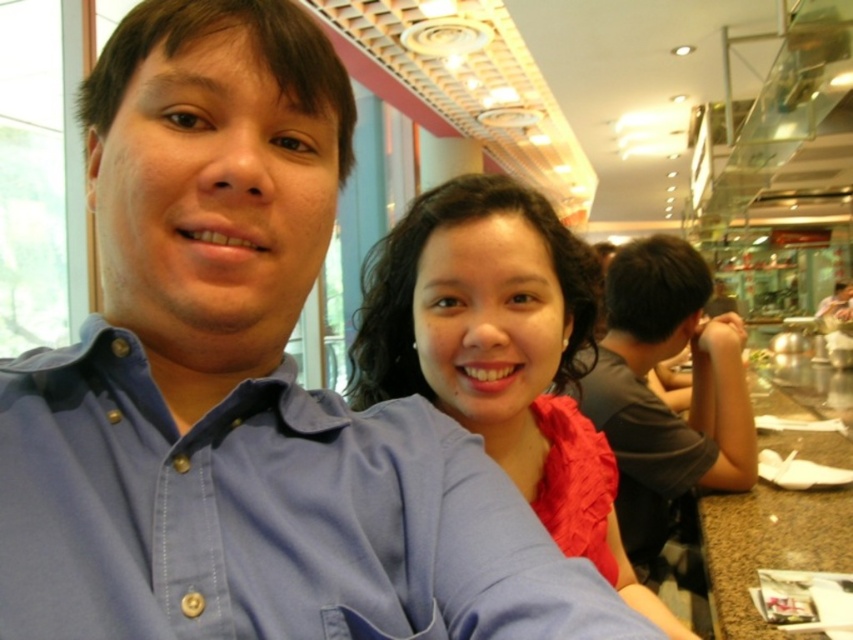
Is matte blue shirt at center to the left of dark gray t-shirt at right from the viewer's perspective?

Correct, you'll find matte blue shirt at center to the left of dark gray t-shirt at right.

I want to click on matte blue shirt at center, so click(x=502, y=353).

This screenshot has height=640, width=853. What are the coordinates of `matte blue shirt at center` in the screenshot? It's located at (502, 353).

Does matte blue shirt at center have a lesser height compared to smooth granite table at lower right?

In fact, matte blue shirt at center may be taller than smooth granite table at lower right.

Is matte blue shirt at center closer to camera compared to smooth granite table at lower right?

Yes.

Which is behind, point (456, 227) or point (717, 563)?

Point (717, 563)

Locate an element on the screen. This screenshot has width=853, height=640. matte blue shirt at center is located at coordinates (502, 353).

Is point (28, 388) positioned before point (788, 493)?

Yes, it is in front of point (788, 493).

Between point (194, 472) and point (717, 579), which one is positioned in front?

Point (194, 472) is in front.

This screenshot has width=853, height=640. I want to click on blue cotton shirt at center, so click(x=264, y=515).